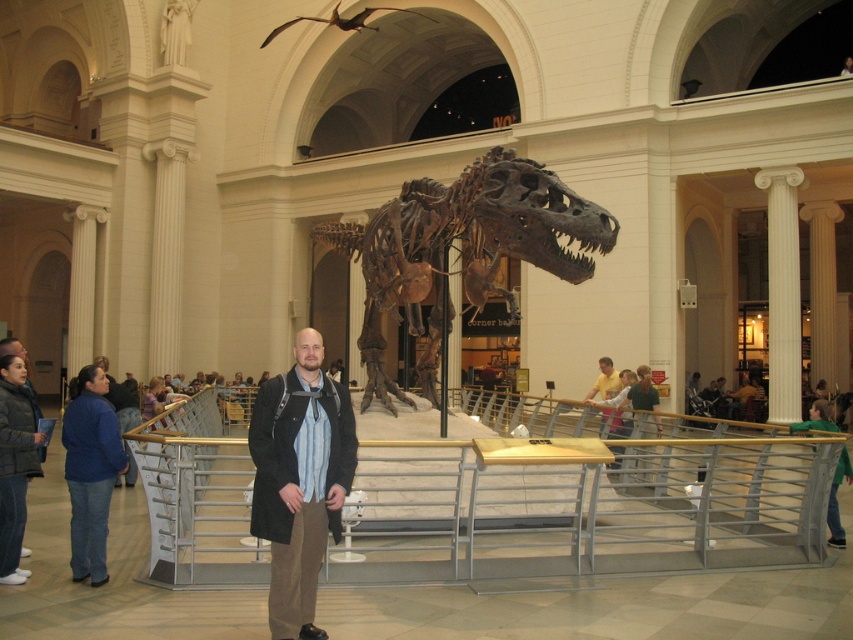
Is rusty metallic dinosaur at center taller than dark brown leather jacket at center?

Indeed, rusty metallic dinosaur at center has a greater height compared to dark brown leather jacket at center.

Does rusty metallic dinosaur at center have a lesser height compared to dark brown leather jacket at center?

No.

Which is behind, point (444, 237) or point (322, 435)?

Positioned behind is point (444, 237).

Locate an element on the screen. This screenshot has width=853, height=640. rusty metallic dinosaur at center is located at coordinates 463,248.

Measure the distance between point (697, 541) and camera.

A distance of 18.33 meters exists between point (697, 541) and camera.

In the scene shown: Can you confirm if metal/textured rail at center is positioned to the right of dark blue puffer jacket at lower left?

Yes, metal/textured rail at center is to the right of dark blue puffer jacket at lower left.

Which is behind, point (193, 577) or point (0, 572)?

The point (193, 577) is behind.

At what (x,y) coordinates should I click in order to perform the action: click on metal/textured rail at center. Please return your answer as a coordinate pair (x, y). The image size is (853, 640). Looking at the image, I should click on (581, 509).

Which is more to the right, blue denim jacket at lower left or dark blue puffer jacket at lower left?

Positioned to the right is dark blue puffer jacket at lower left.

Does point (107, 509) lie in front of point (3, 468)?

No, it is behind (3, 468).

What do you see at coordinates (90, 470) in the screenshot? I see `blue denim jacket at lower left` at bounding box center [90, 470].

Where is `blue denim jacket at lower left`? Image resolution: width=853 pixels, height=640 pixels. blue denim jacket at lower left is located at coordinates (90, 470).